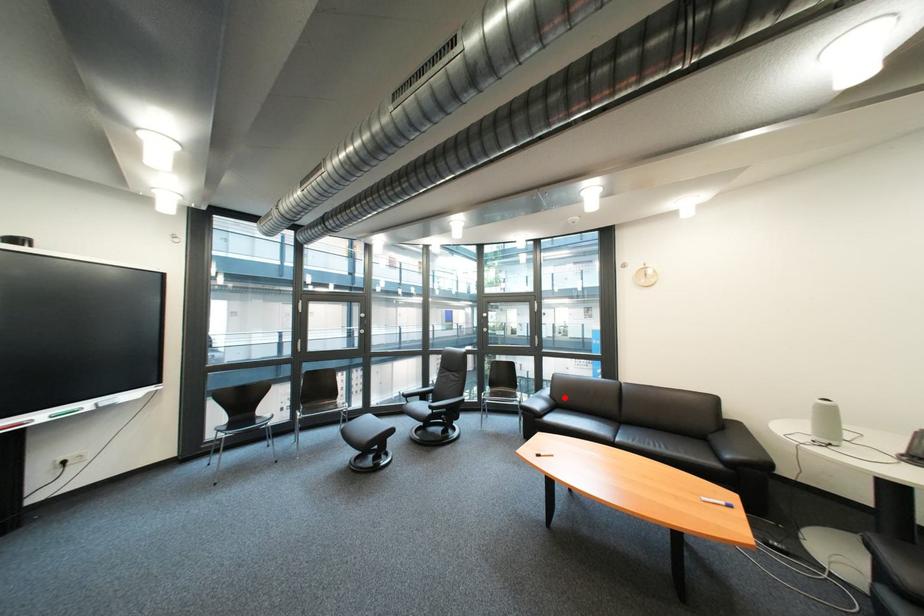
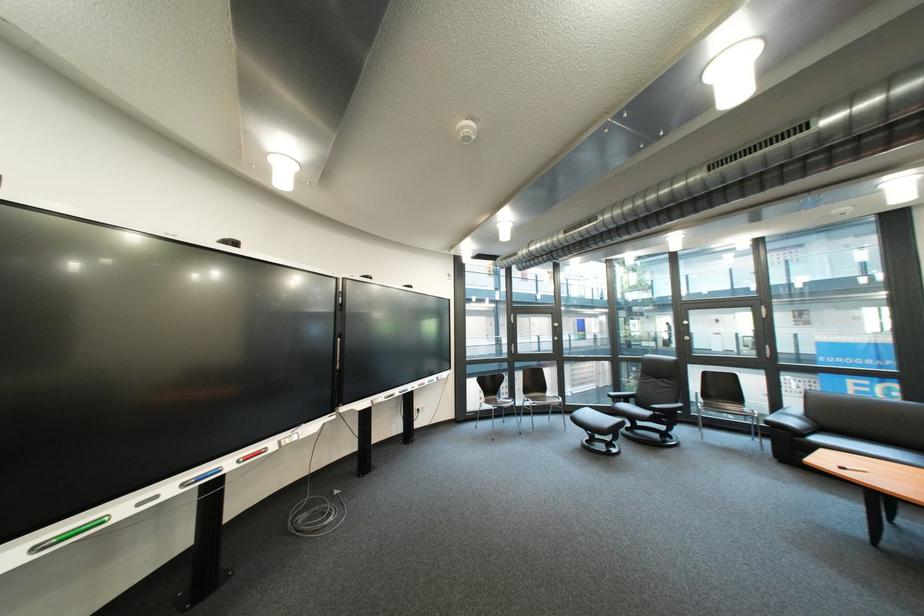
Question: I am providing you with two images of the same scene from different viewpoints. Image1 has a red point marked. In image2, the corresponding 3D location appears at what relative position? Reply with the corresponding letter.

Choices:
 (A) Closer
 (B) Farther

Answer: (A)